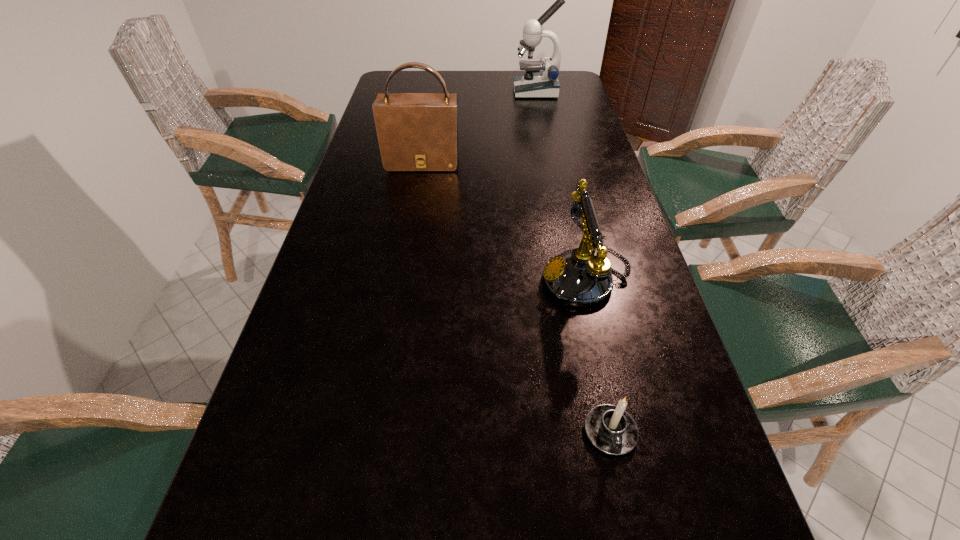
You are a GUI agent. You are given a task and a screenshot of the screen. Output one action in this format:
    pyautogui.click(x=<x>, y=<y>)
    Task: Click on the vacant area between the telephone and the shortest object
    
    Given the screenshot: What is the action you would take?
    pyautogui.click(x=598, y=355)

Where is `the third closest object to the nearest object`? The width and height of the screenshot is (960, 540). the third closest object to the nearest object is located at coordinates (545, 84).

Find the location of `the closest object relative to the third farthest object`. the closest object relative to the third farthest object is located at coordinates (612, 430).